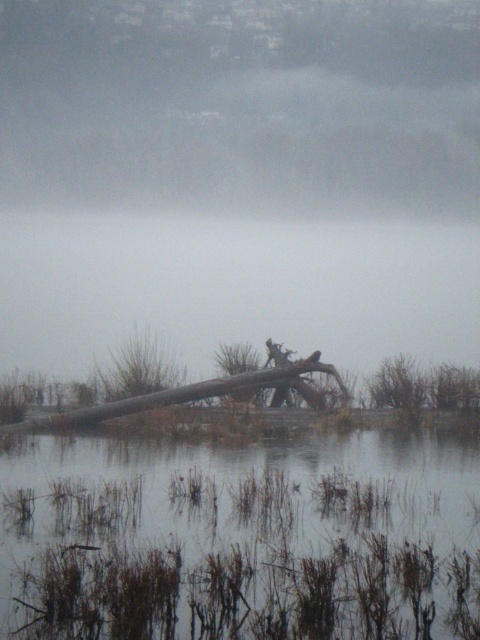
You are standing at the edge of the water in the scene. Which part of the water would you step into first, the brown grassy water at lower center or the transparent water at center?

The brown grassy water at lower center is closer to the viewer, so you would step into it first before reaching the transparent water at center.

You are standing in the serene landscape and notice the foggy mist at upper center. Can you determine its exact position using coordinates?

The foggy mist at upper center is located at point coordinates [241,99].

You are an observer standing at the edge of the water. Which object, the foggy mist at upper center or the transparent water at center, is closer to you?

The foggy mist at upper center is closer to you because the transparent water at center is behind it.